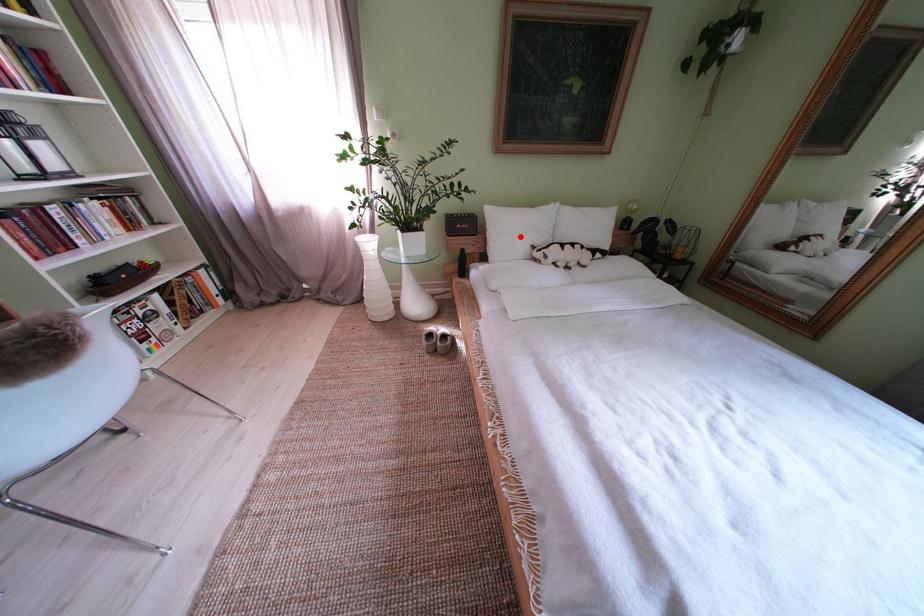
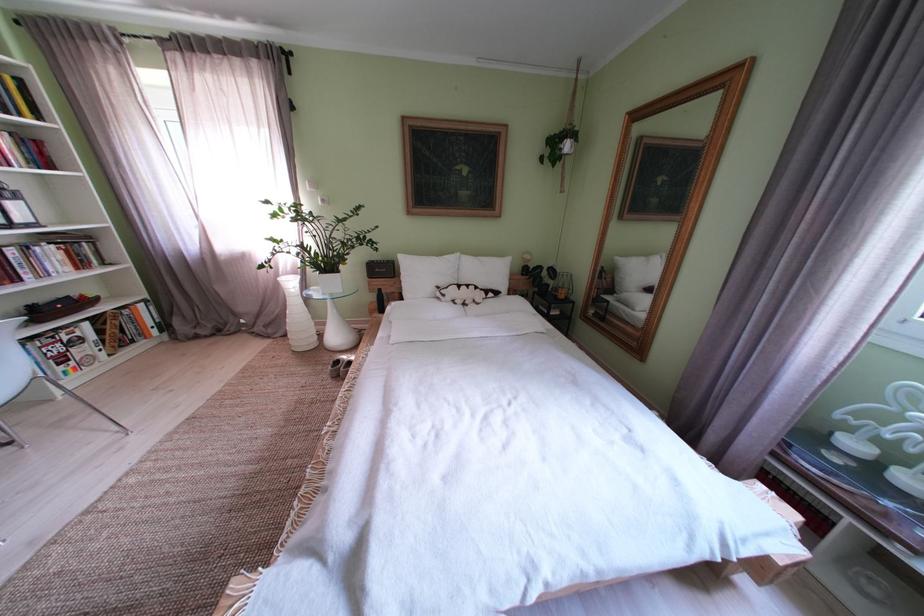
Question: I am providing you with two images of the same scene from different viewpoints. A red point is marked on the first image. Can you still see the location of the red point in image 2?

Choices:
 (A) Yes
 (B) No

Answer: (A)